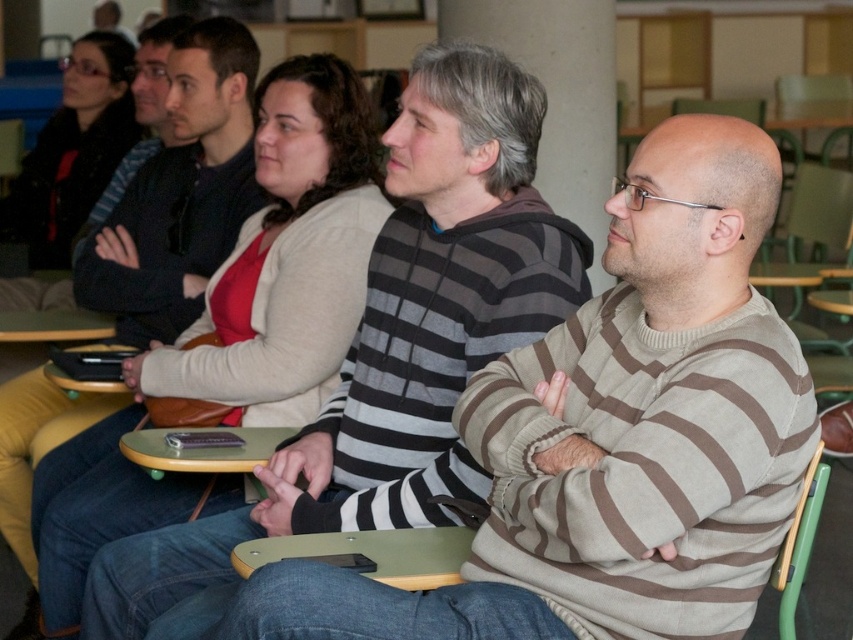
Question: Does matte black jacket at upper left have a larger size compared to green plastic chair at right?

Choices:
 (A) no
 (B) yes

Answer: (B)

Question: Can you confirm if striped sweater at center is thinner than green plastic chair at right?

Choices:
 (A) yes
 (B) no

Answer: (B)

Question: Is striped sweater at center positioned behind matte beige sweater at center?

Choices:
 (A) yes
 (B) no

Answer: (B)

Question: Which point is closer to the camera?

Choices:
 (A) (355, 241)
 (B) (49, 182)
 (C) (480, 388)

Answer: (C)

Question: Which of the following is the farthest from the observer?

Choices:
 (A) matte beige sweater at center
 (B) green plastic chair at right
 (C) matte black jacket at upper left

Answer: (C)

Question: Which of these objects is positioned closest to the striped sweater at center?

Choices:
 (A) matte beige sweater at center
 (B) green plastic chair at right

Answer: (B)